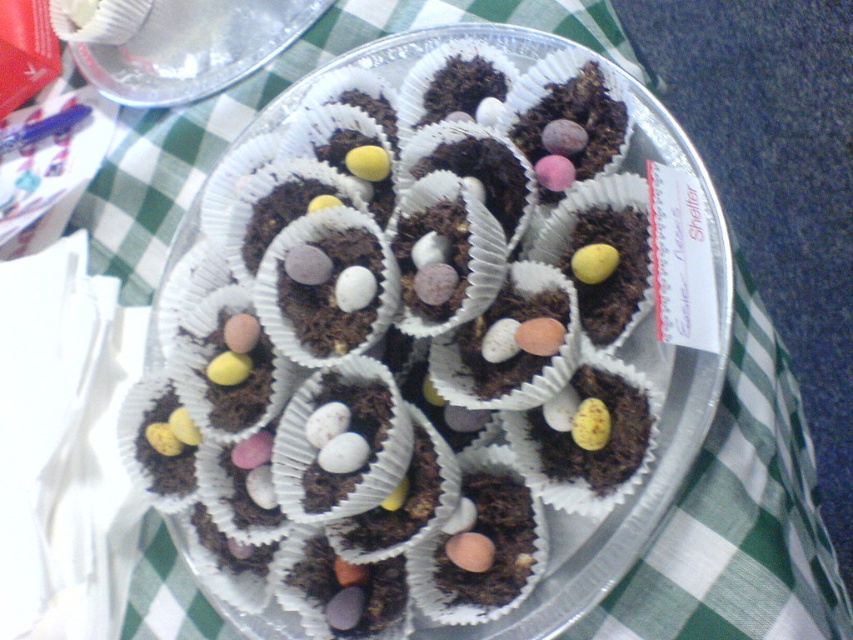
Question: Does chocolate cake at center have a larger size compared to transparent plastic plate at upper center?

Choices:
 (A) yes
 (B) no

Answer: (A)

Question: Which of the following is the farthest from the observer?

Choices:
 (A) transparent plastic plate at upper center
 (B) chocolate cake at center

Answer: (A)

Question: Does chocolate cake at center have a larger size compared to transparent plastic plate at upper center?

Choices:
 (A) yes
 (B) no

Answer: (A)

Question: Which point is farther to the camera?

Choices:
 (A) coord(169,45)
 (B) coord(223,108)

Answer: (A)

Question: Can you confirm if chocolate cake at center is bigger than transparent plastic plate at upper center?

Choices:
 (A) yes
 (B) no

Answer: (A)